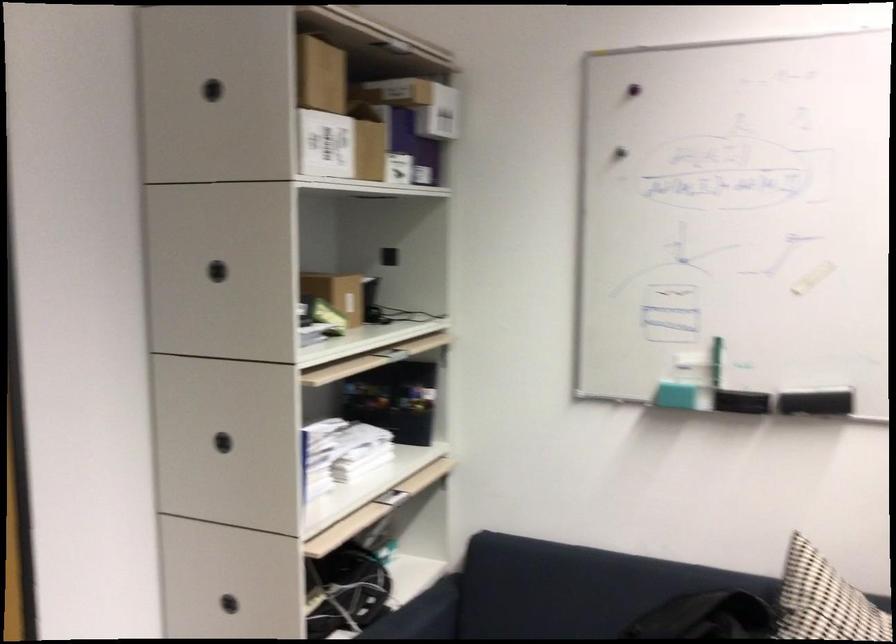
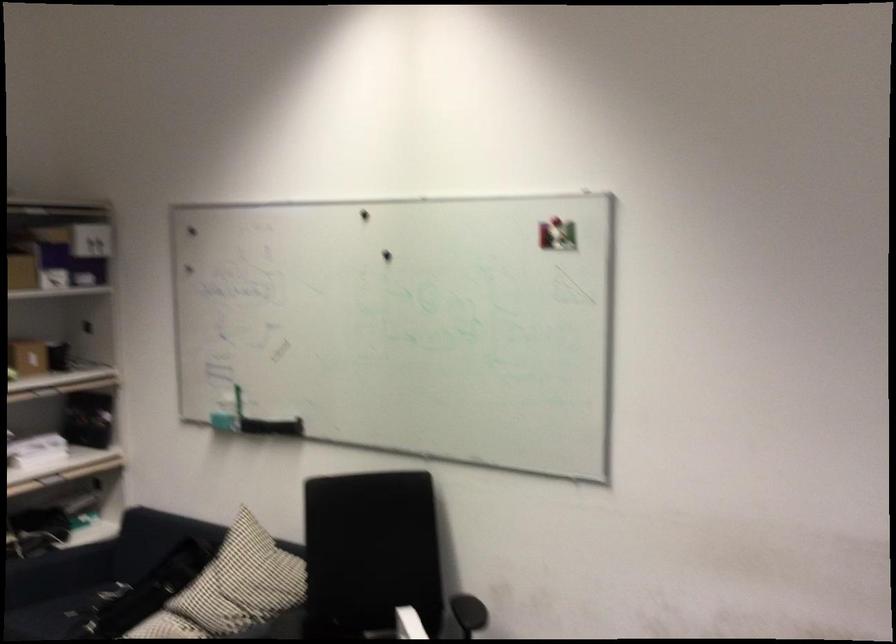
In the second image, find the point that corresponds to [616,89] in the first image.

(192, 231)